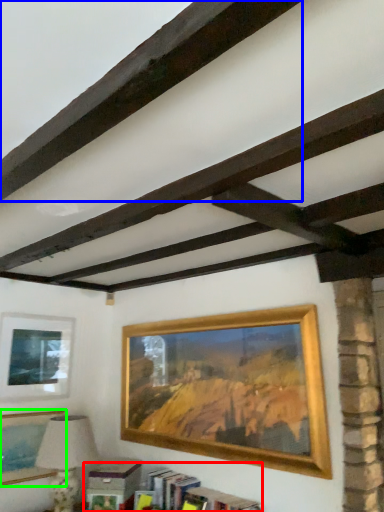
Question: Which is farther away from bookcase (highlighted by a red box)? plank (highlighted by a blue box) or picture frame (highlighted by a green box)?

Choices:
 (A) plank
 (B) picture frame

Answer: (A)